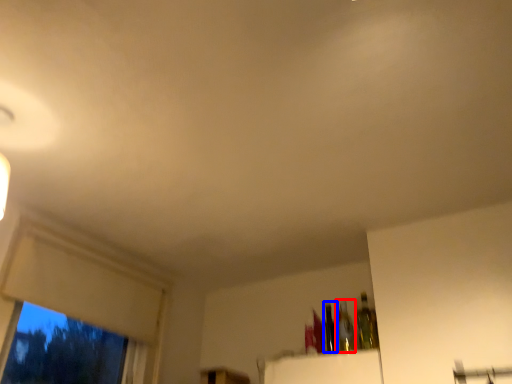
Question: Which object appears closest to the camera in this image, bottle (highlighted by a red box) or bottle (highlighted by a blue box)?

Choices:
 (A) bottle
 (B) bottle

Answer: (A)